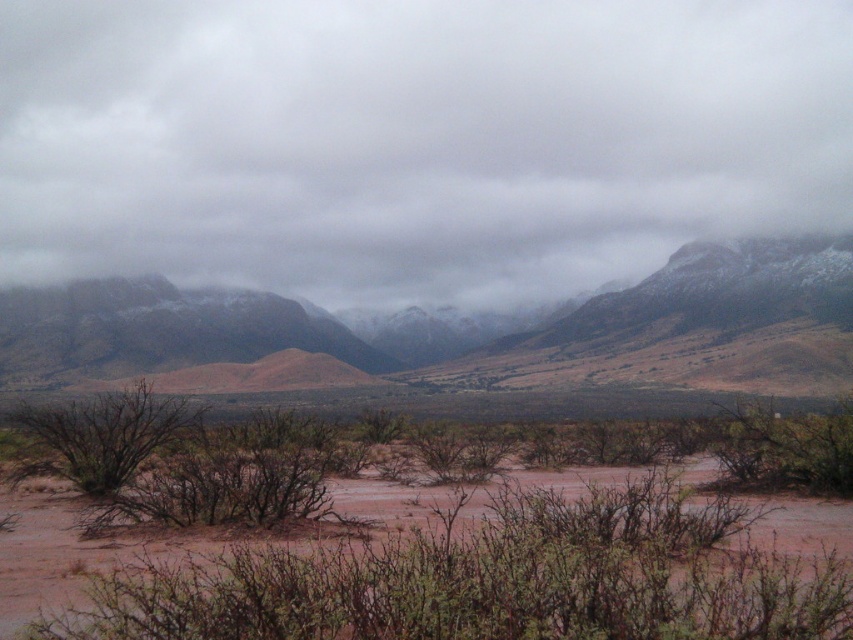
Can you confirm if brown dry bush at center is positioned above brown dry bush at lower left?

No.

Who is positioned more to the left, brown dry bush at center or brown dry bush at lower left?

brown dry bush at lower left

Between point (97, 513) and point (136, 401), which one is positioned behind?

Point (136, 401)

In order to click on brown dry bush at center in this screenshot , I will do `click(231, 476)`.

Based on the photo, which of these two, cloudy gray sky at upper center or brown dry bush at center, stands shorter?

Standing shorter between the two is brown dry bush at center.

Is point (370, 291) farther from viewer compared to point (231, 477)?

Yes, it is.

Where is `cloudy gray sky at upper center`? cloudy gray sky at upper center is located at coordinates (415, 140).

Does brown sandy soil at center have a greater height compared to brown dry bush at center?

Indeed, brown sandy soil at center has a greater height compared to brown dry bush at center.

Can you confirm if brown sandy soil at center is positioned to the left of brown dry bush at center?

Incorrect, brown sandy soil at center is not on the left side of brown dry bush at center.

Between point (824, 572) and point (254, 452), which one is positioned in front?

Point (824, 572)

Find the location of `brown sandy soil at center`. brown sandy soil at center is located at coordinates (490, 579).